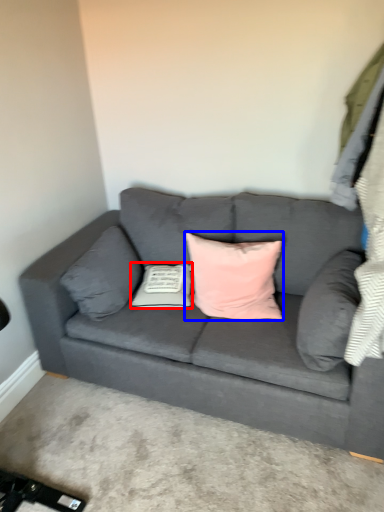
Question: Which of the following is the closest to the observer, pillow (highlighted by a red box) or pillow (highlighted by a blue box)?

Choices:
 (A) pillow
 (B) pillow

Answer: (B)